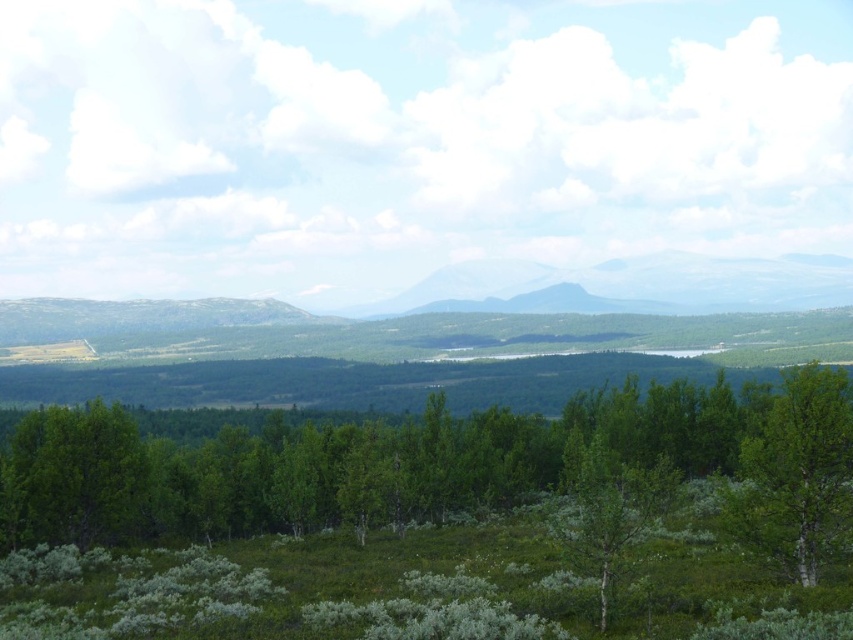
You are planning to set up a small tent between the green leafy tree at lower left and the green matte tree at center. Considering their thickness, which tree would provide more shade coverage for the tent?

The green matte tree at center is thicker than the green leafy tree at lower left, so it would provide more shade coverage for the tent.

You are standing at the center of the scene. Which direction should you look to see the green leafy tree at lower left?

The green leafy tree at lower left is located at point [73,476], so you should look to your lower left direction to see it.